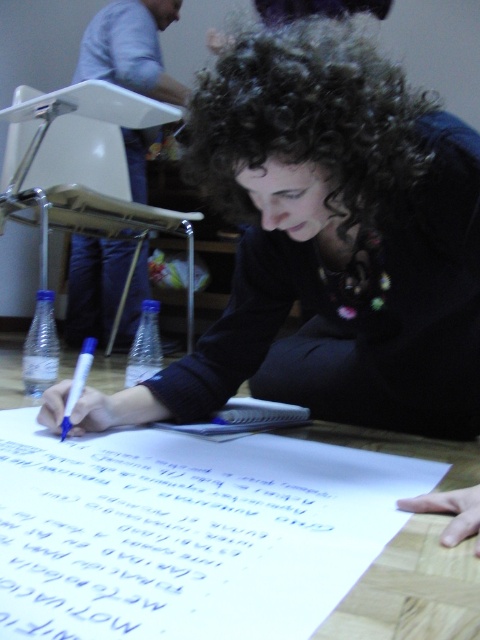
You are organizing supplies in a classroom and need to place the clear plastic bottle at lower left and the blue marker at lower left into a drawer. The drawer has a width of 10 cm. Can both items fit side by side horizontally?

The clear plastic bottle at lower left is wider than the blue marker at lower left. Since the bottle is wider, if its width exceeds 10 cm, it alone might not fit. However, if both combined widths are under 10 cm, they could fit. But since the bottle is wider than the marker, and the total required space isnecessary to know exact measurements. Without specific widths, we can only say the bottle is wider, but cannot confirm if both fit without knowing their exact sizes.